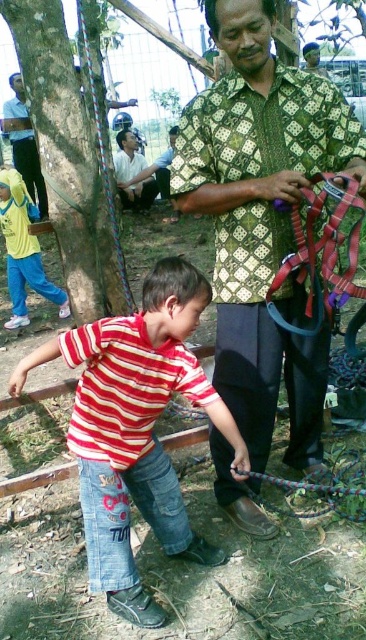
From the picture: You are a photographer trying to capture a clear shot of the striped cotton shirt at center and the brushed metal helmet at upper left. Since you want both objects to appear the same size in the photo, which object should you move closer to the camera?

The brushed metal helmet at upper left should be moved closer to the camera because it is currently smaller than the striped cotton shirt at center, so bringing it nearer would balance their sizes in the frame.

You are a photographer trying to capture a photo of the yellow fabric shirt at left without including the brown rough tree at upper left in the frame. Based on their positions, is this possible?

The brown rough tree at upper left is located above the yellow fabric shirt at left, so if you position your camera to focus on the lower part of the yellow fabric shirt at left and avoid looking upward, you can exclude the tree from the frame.

You are standing in the park and want to take a photo of the brown rough tree at upper left. If your camera has a maximum focus range of 8 feet, will you need to move closer to the tree to get it in focus?

The brown rough tree at upper left is 8.24 feet away from the viewer, which is slightly beyond the camera maximum focus range of 8 feet. You need to move closer to the tree to get it in focus.